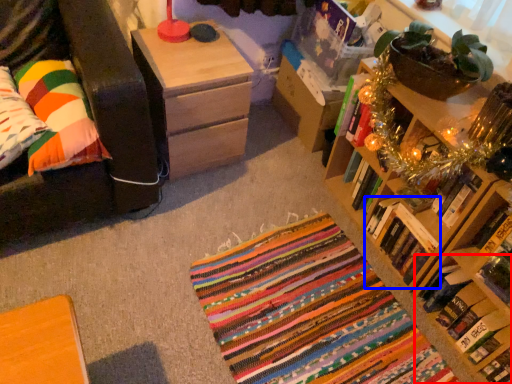
Question: Which of the following is the closest to the observer, book (highlighted by a red box) or book (highlighted by a blue box)?

Choices:
 (A) book
 (B) book

Answer: (A)